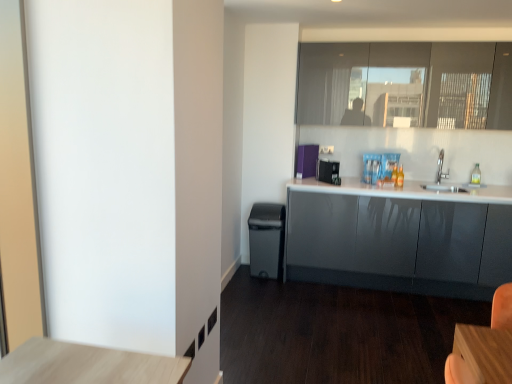
Question: Considering the positions of glossy gray cabinets at right and matte black trash can at lower center in the image, is glossy gray cabinets at right bigger or smaller than matte black trash can at lower center?

Choices:
 (A) small
 (B) big

Answer: (B)

Question: Is glossy gray cabinets at right situated inside matte black trash can at lower center or outside?

Choices:
 (A) outside
 (B) inside

Answer: (A)

Question: Estimate the real-world distances between objects in this image. Which object is closer to the silver metallic sink at upper right?

Choices:
 (A) matte glass window at upper right
 (B) purple fabric at upper center, which ranks as the 1th appliance in back-to-front order
 (C) glossy gray cabinets at right
 (D) black plastic toaster at center, the second appliance in the back-to-front sequence
 (E) matte black trash can at lower center

Answer: (C)

Question: Which object is the closest to the glossy gray cabinets at right?

Choices:
 (A) purple fabric at upper center, positioned as the 2th appliance in front-to-back order
 (B) transparent plastic bottle at right
 (C) black plastic toaster at center, the first appliance viewed from the front
 (D) matte glass window at upper right
 (E) silver metallic sink at upper right

Answer: (E)